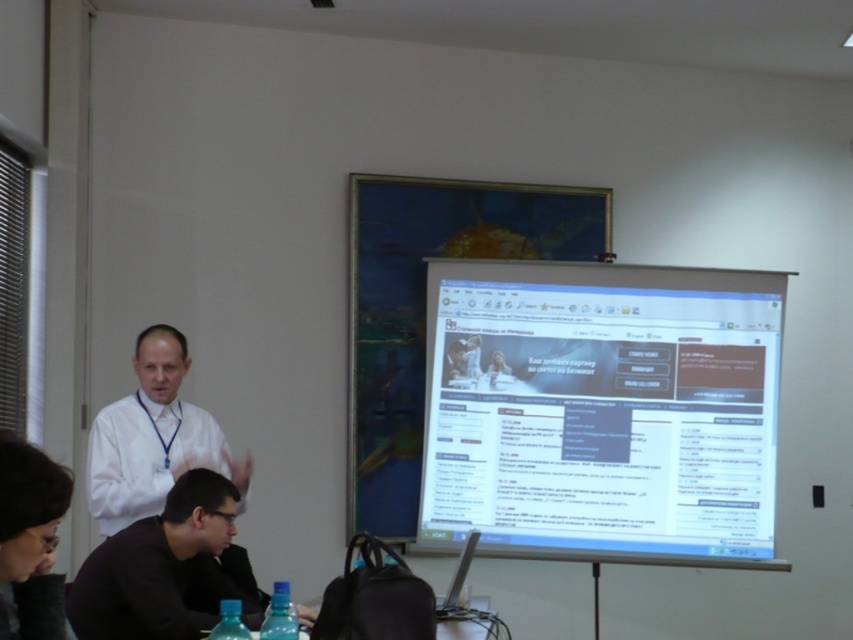
Does black matte jacket at lower center have a larger size compared to clear plastic bottles at lower center?

Indeed, black matte jacket at lower center has a larger size compared to clear plastic bottles at lower center.

Image resolution: width=853 pixels, height=640 pixels. What do you see at coordinates (167, 570) in the screenshot?
I see `black matte jacket at lower center` at bounding box center [167, 570].

Where is `black matte jacket at lower center`? Image resolution: width=853 pixels, height=640 pixels. black matte jacket at lower center is located at coordinates (167, 570).

Can you confirm if white glossy screen at center is positioned to the right of clear plastic bottles at lower center?

Correct, you'll find white glossy screen at center to the right of clear plastic bottles at lower center.

From the picture: Is white glossy screen at center closer to the viewer compared to clear plastic bottles at lower center?

No, white glossy screen at center is behind clear plastic bottles at lower center.

Looking at this image, who is more distant from viewer, (524, 310) or (448, 612)?

The point (524, 310) is behind.

You are a GUI agent. You are given a task and a screenshot of the screen. Output one action in this format:
    pyautogui.click(x=<x>, y=<y>)
    Task: Click on the white glossy screen at center
    
    Given the screenshot: What is the action you would take?
    coord(601,412)

Does point (206, 577) lie in front of point (177, 346)?

That is True.

Does black matte jacket at lower center have a smaller size compared to white shirt at left?

Yes.

Find the location of a particular element. black matte jacket at lower center is located at coordinates (167, 570).